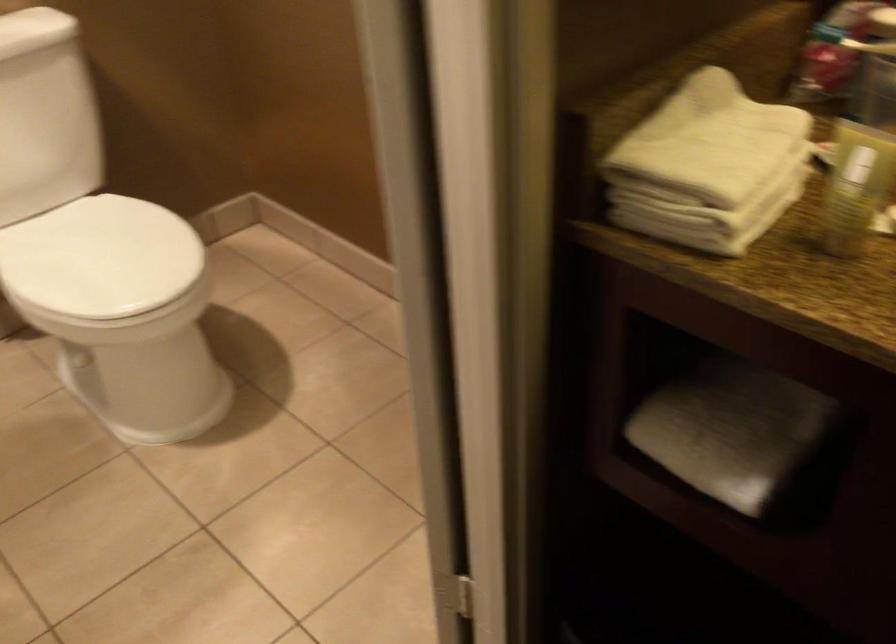
Identify the location of white toilet lid. (99, 257).